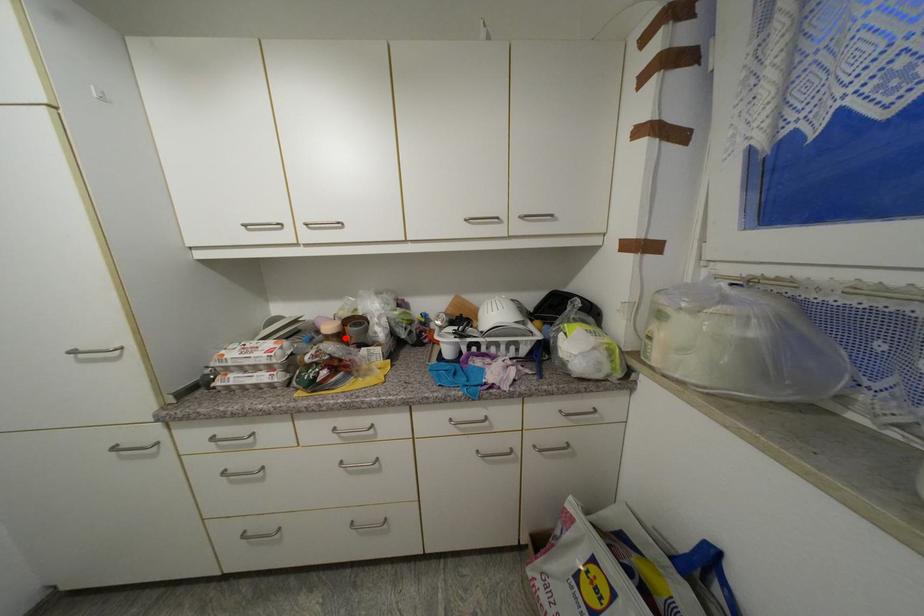
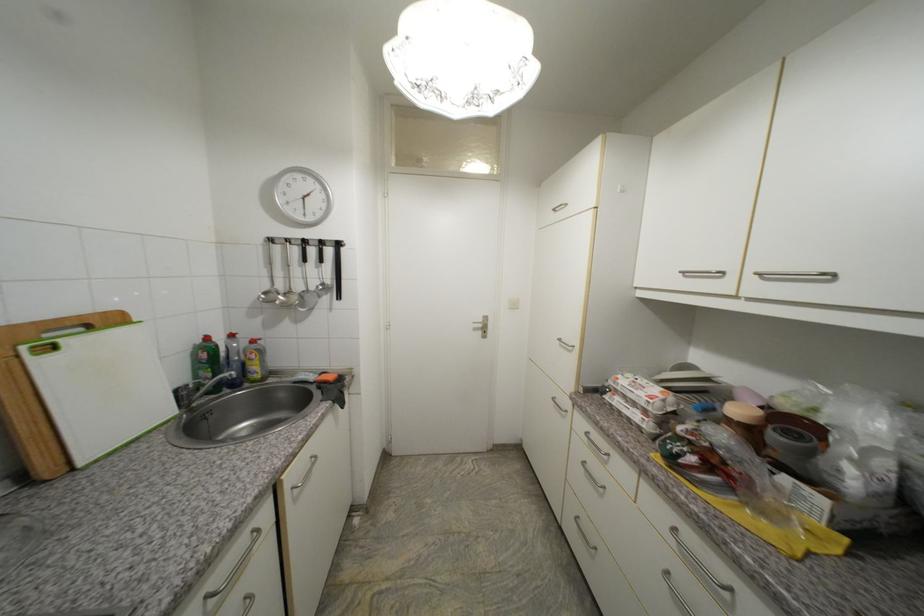
Find the pixel in the second image that matches the highlighted location in the first image.

(756, 432)